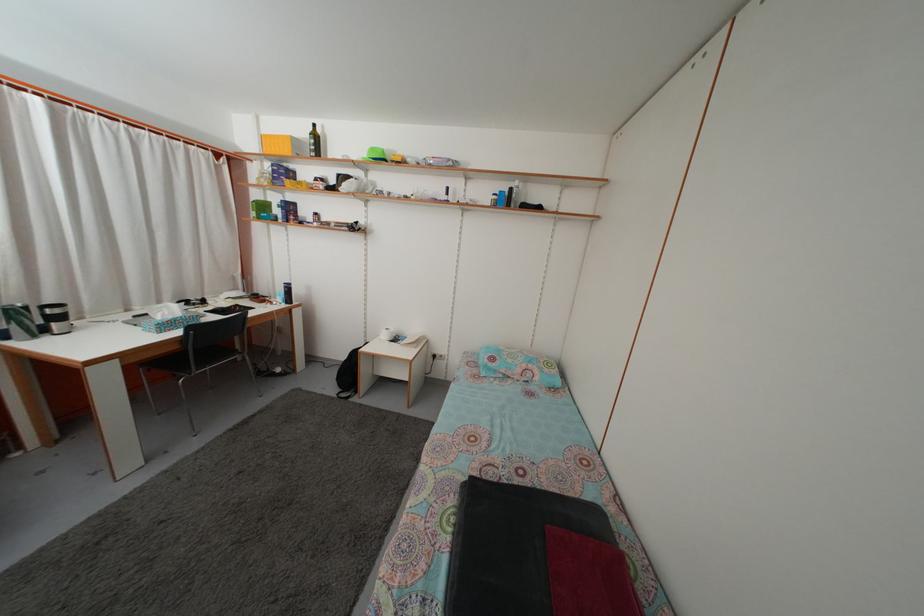
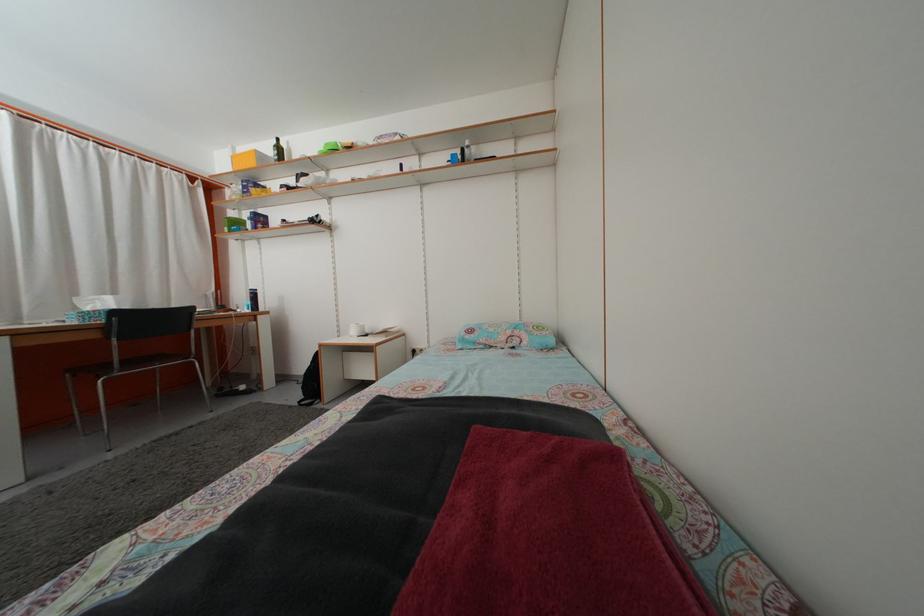
Where in the second image is the point corresponding to pixel 261 201 from the first image?

(237, 223)